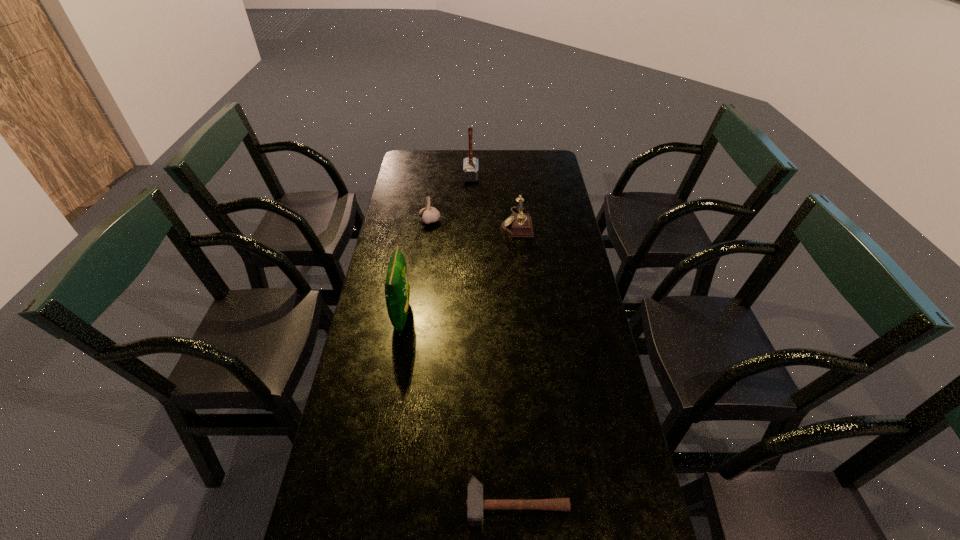
You are a GUI agent. You are given a task and a screenshot of the screen. Output one action in this format:
    pyautogui.click(x=<x>, y=<y>)
    Task: Click on the free space at the far left corner of the desktop
    
    Given the screenshot: What is the action you would take?
    pyautogui.click(x=434, y=161)

In the image, there is a desktop. Identify the location of vacant space at the far right corner. (547, 163).

Identify the location of free space that is in between the telephone and the garlic. (473, 222).

Identify the location of empty location between the second nearest object and the garlic. (416, 268).

The height and width of the screenshot is (540, 960). Find the location of `vacant space that is in between the garlic and the fourth farthest object`. vacant space that is in between the garlic and the fourth farthest object is located at coordinates (416, 268).

Locate an element on the screen. unoccupied position between the taller hammer and the telephone is located at coordinates (493, 200).

Where is `unoccupied area between the telephone and the fourth farthest object`? The width and height of the screenshot is (960, 540). unoccupied area between the telephone and the fourth farthest object is located at coordinates (459, 269).

Identify the location of unoccupied area between the shorter hammer and the telephone. This screenshot has height=540, width=960. (516, 363).

At what (x,y) coordinates should I click in order to perform the action: click on vacant point located between the garlic and the shortest object. Please return your answer as a coordinate pair (x, y). This screenshot has width=960, height=540. Looking at the image, I should click on (473, 362).

This screenshot has width=960, height=540. In order to click on free space between the nearest object and the garlic in this screenshot , I will do `click(473, 362)`.